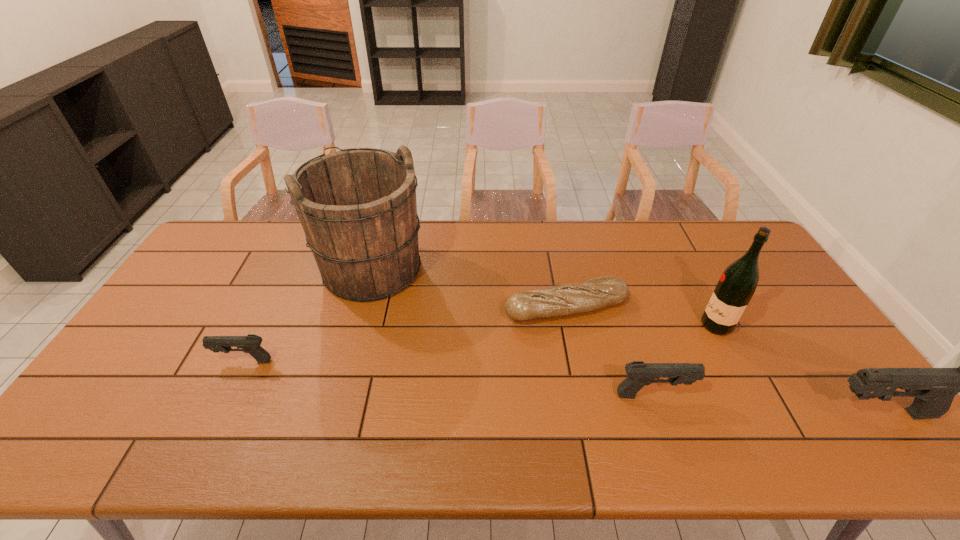
The width and height of the screenshot is (960, 540). Identify the location of object that ranks as the second closest to the second shortest pistol. (737, 284).

Choose which object is the second nearest neighbor to the fifth object from left to right. Please provide its 2D coordinates. Your answer should be formatted as a tuple, i.e. [(x, y)], where the tuple contains the x and y coordinates of a point satisfying the conditions above.

[(639, 374)]

Locate an element on the screen. This screenshot has height=540, width=960. pistol that is the third closest one to the baguet is located at coordinates (251, 343).

Identify the location of pistol that is the closest to the fourth farthest object. Image resolution: width=960 pixels, height=540 pixels. pyautogui.click(x=639, y=374).